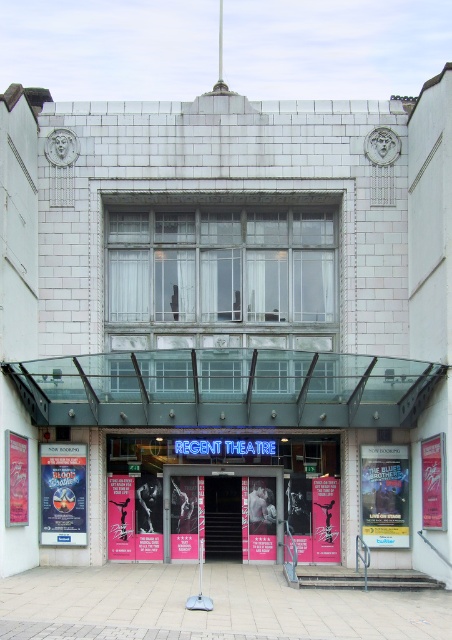
At what (x,y) coordinates should I click in order to perform the action: click on pink glossy posters at center. Please return your answer as a coordinate pair (x, y). Looking at the image, I should click on (221, 497).

Measure the distance between pink glossy posters at center and camera.

pink glossy posters at center and camera are 27.47 meters apart.

This screenshot has width=452, height=640. Identify the location of pink glossy posters at center. (221, 497).

Who is taller, metallic blue poster at center or blue glossy poster at center?

Standing taller between the two is blue glossy poster at center.

Which is behind, point (368, 522) or point (71, 476)?

Positioned behind is point (71, 476).

Locate an element on the screen. This screenshot has height=640, width=452. metallic blue poster at center is located at coordinates (385, 496).

Does point (372, 467) come closer to viewer compared to point (282, 490)?

That is True.

Who is lower down, metallic blue poster at center or pink poster at center?

pink poster at center

Which is behind, point (384, 456) or point (277, 554)?

Point (277, 554)

This screenshot has height=640, width=452. Identify the location of metallic blue poster at center. (385, 496).